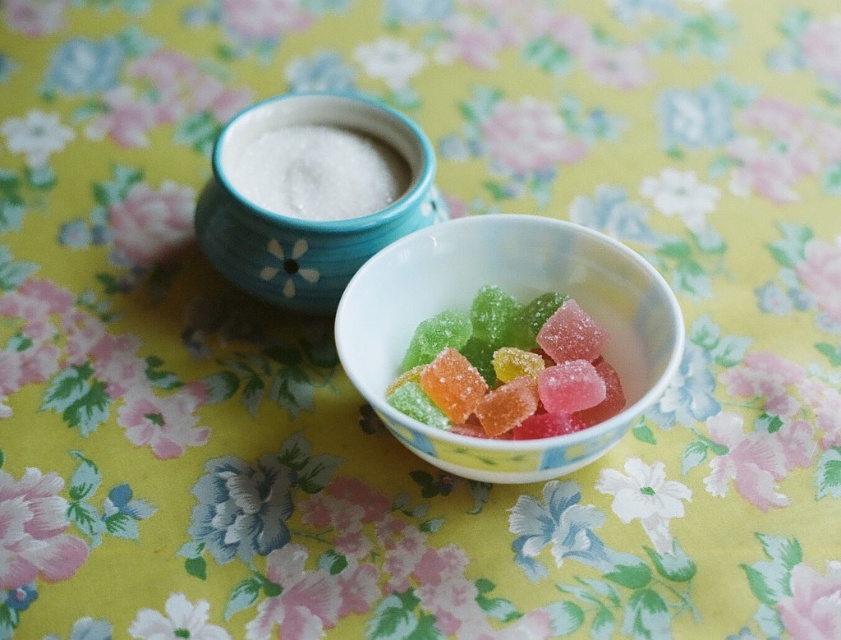
Is translucent sugar cubes at center above blue ceramic bowl at upper center?

No, translucent sugar cubes at center is not above blue ceramic bowl at upper center.

Which is above, translucent sugar cubes at center or blue ceramic bowl at upper center?

blue ceramic bowl at upper center

The height and width of the screenshot is (640, 841). What are the coordinates of `translucent sugar cubes at center` in the screenshot? It's located at (508, 369).

Locate an element on the screen. translucent sugar cubes at center is located at coordinates (508, 369).

Can you confirm if porcelain bowl at center is wider than blue ceramic bowl at upper center?

Correct, the width of porcelain bowl at center exceeds that of blue ceramic bowl at upper center.

Is porcelain bowl at center shorter than blue ceramic bowl at upper center?

Yes.

Locate an element on the screen. The height and width of the screenshot is (640, 841). porcelain bowl at center is located at coordinates (516, 298).

Which is in front, point (496, 243) or point (341, 186)?

Point (496, 243)

Between porcelain bowl at center and white granular sugar at upper center, which one appears on the left side from the viewer's perspective?

white granular sugar at upper center is more to the left.

Between point (521, 298) and point (326, 160), which one is positioned in front?

Point (521, 298) is in front.

Where is `porcelain bowl at center`? This screenshot has height=640, width=841. porcelain bowl at center is located at coordinates (516, 298).